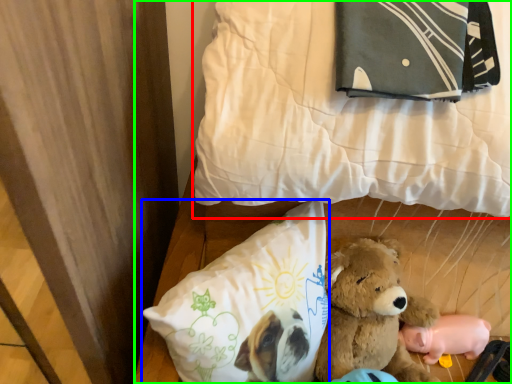
Question: Which object is the closest to the pillow (highlighted by a red box)? Choose among these: pillow (highlighted by a blue box) or bed (highlighted by a green box).

Choices:
 (A) pillow
 (B) bed

Answer: (B)